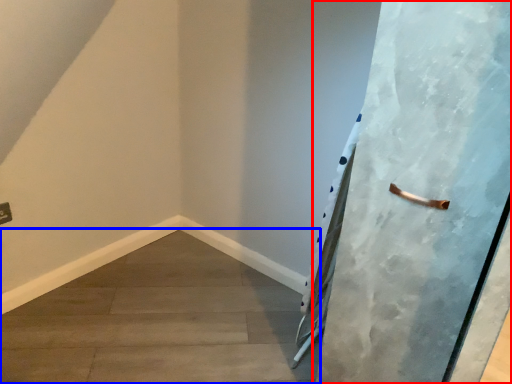
Question: Which object is further to the camera taking this photo, door (highlighted by a red box) or concrete (highlighted by a blue box)?

Choices:
 (A) door
 (B) concrete

Answer: (B)